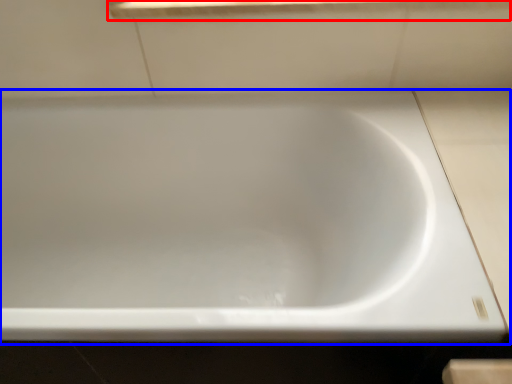
Question: Which object appears closest to the camera in this image, window sill (highlighted by a red box) or bathtub (highlighted by a blue box)?

Choices:
 (A) window sill
 (B) bathtub

Answer: (B)